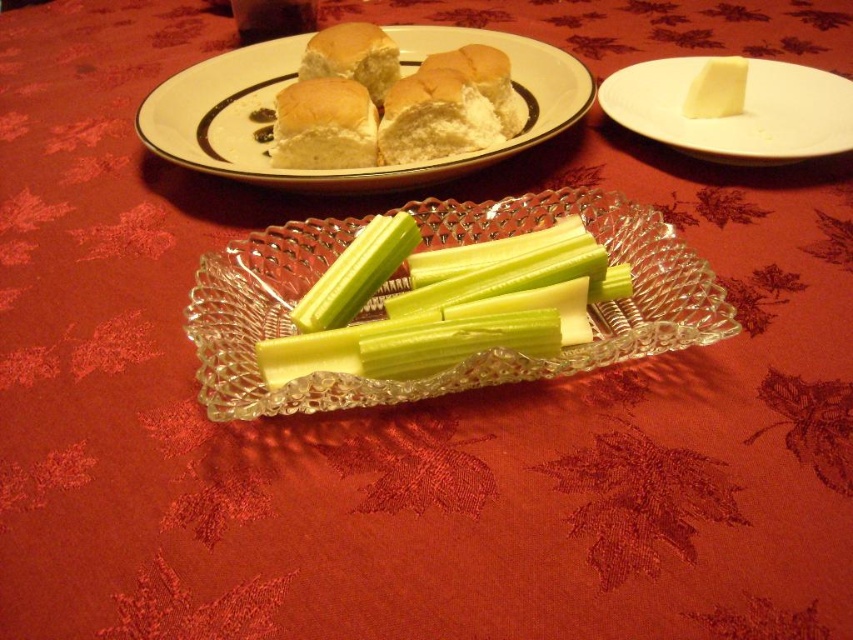
Is green crisp celery at center below golden brown bread rolls at upper center?

Yes.

Who is more distant from viewer, (300, 324) or (465, 92)?

Point (465, 92)

Is point (535, 285) behind point (485, 125)?

That is False.

Identify the location of green crisp celery at center. This screenshot has width=853, height=640. (447, 304).

Is golden brown bread rolls at upper center thinner than yellow creamy cheese at upper right?

In fact, golden brown bread rolls at upper center might be wider than yellow creamy cheese at upper right.

Between point (361, 166) and point (706, 86), which one is positioned in front?

Positioned in front is point (361, 166).

This screenshot has height=640, width=853. Identify the location of golden brown bread rolls at upper center. (392, 104).

Is matte white bread at upper center thinner than yellow creamy cheese at upper right?

No, matte white bread at upper center is not thinner than yellow creamy cheese at upper right.

Image resolution: width=853 pixels, height=640 pixels. In order to click on matte white bread at upper center in this screenshot , I will do `click(323, 125)`.

Identify the location of matte white bread at upper center. (323, 125).